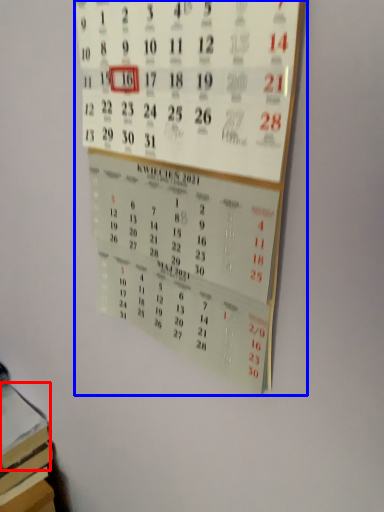
Question: Which of the following is the closest to the observer, book (highlighted by a red box) or bulletin board (highlighted by a blue box)?

Choices:
 (A) book
 (B) bulletin board

Answer: (B)